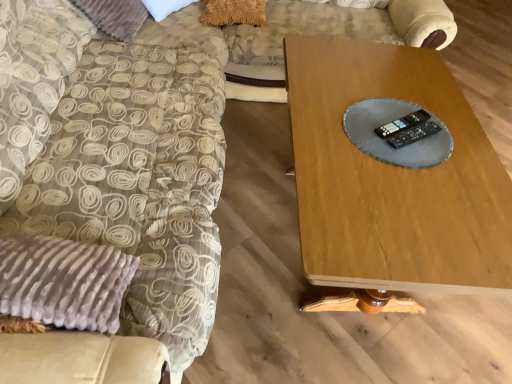
Where is `free spot to the right of black plastic remote at center, which is the first control from bottom to top`? Image resolution: width=512 pixels, height=384 pixels. free spot to the right of black plastic remote at center, which is the first control from bottom to top is located at coordinates (460, 148).